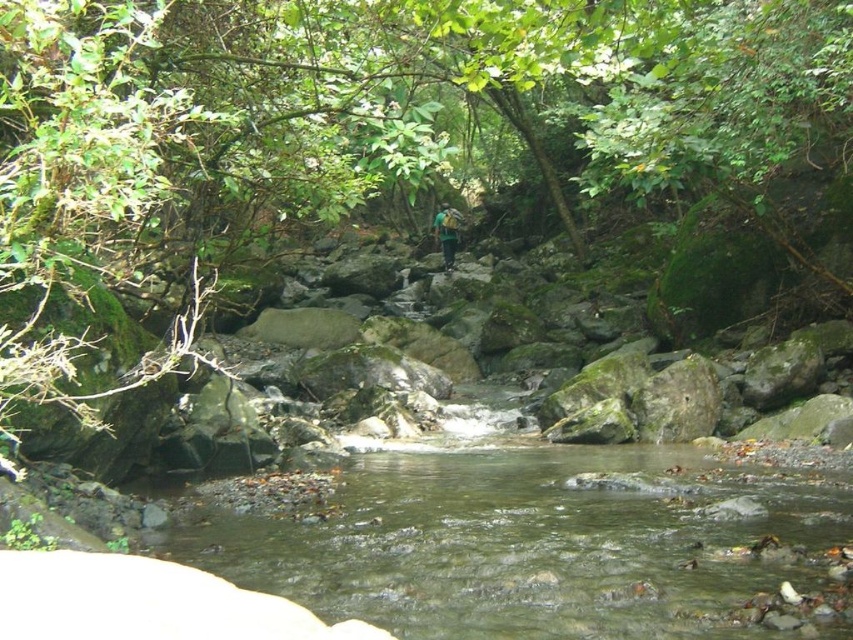
Question: Does clear water at center have a lesser width compared to green fabric backpack at center?

Choices:
 (A) yes
 (B) no

Answer: (B)

Question: Which point is farther to the camera?

Choices:
 (A) green fabric backpack at center
 (B) clear water at center

Answer: (A)

Question: Does clear water at center have a lesser width compared to green fabric backpack at center?

Choices:
 (A) no
 (B) yes

Answer: (A)

Question: Does clear water at center appear under green fabric backpack at center?

Choices:
 (A) no
 (B) yes

Answer: (B)

Question: Which of the following is the farthest from the observer?

Choices:
 (A) green fabric backpack at center
 (B) clear water at center

Answer: (A)